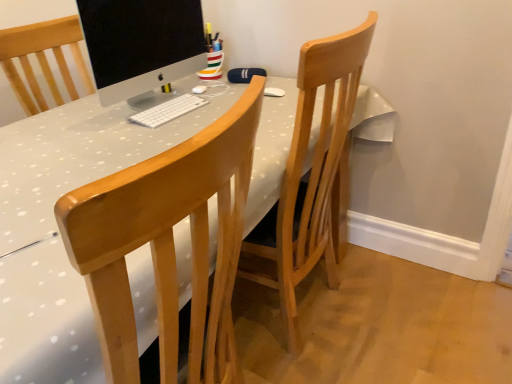
Question: Is white matte keyboard at center at the back of sleek silver monitor at center?

Choices:
 (A) yes
 (B) no

Answer: (B)

Question: Is sleek silver monitor at center further to camera compared to white matte keyboard at center?

Choices:
 (A) yes
 (B) no

Answer: (B)

Question: Considering the relative sizes of sleek silver monitor at center and white matte keyboard at center in the image provided, is sleek silver monitor at center smaller than white matte keyboard at center?

Choices:
 (A) yes
 (B) no

Answer: (B)

Question: Can you confirm if sleek silver monitor at center is wider than white matte keyboard at center?

Choices:
 (A) no
 (B) yes

Answer: (A)

Question: Is sleek silver monitor at center to the left of white matte keyboard at center from the viewer's perspective?

Choices:
 (A) yes
 (B) no

Answer: (A)

Question: Is sleek silver monitor at center at the right side of white matte keyboard at center?

Choices:
 (A) yes
 (B) no

Answer: (B)

Question: Is white matte keyboard at center at the back of wooden chair at center?

Choices:
 (A) no
 (B) yes

Answer: (A)

Question: Can you confirm if wooden chair at center is positioned to the left of white matte keyboard at center?

Choices:
 (A) no
 (B) yes

Answer: (A)

Question: Does wooden chair at center have a larger size compared to white matte keyboard at center?

Choices:
 (A) yes
 (B) no

Answer: (A)

Question: Is wooden chair at center positioned far away from white matte keyboard at center?

Choices:
 (A) no
 (B) yes

Answer: (A)

Question: Is wooden chair at center in front of white matte keyboard at center?

Choices:
 (A) no
 (B) yes

Answer: (B)

Question: Is wooden chair at center behind white matte keyboard at center?

Choices:
 (A) no
 (B) yes

Answer: (A)

Question: Is white matte keyboard at center to the left of wooden chair at center from the viewer's perspective?

Choices:
 (A) yes
 (B) no

Answer: (A)